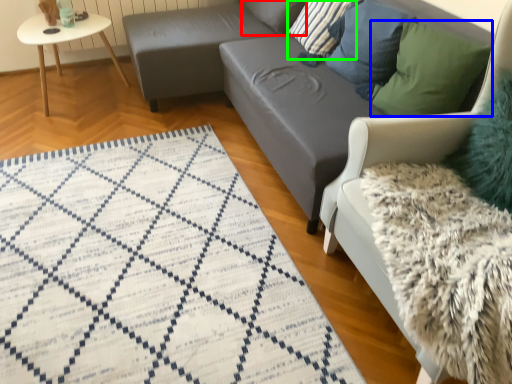
Question: Based on their relative distances, which object is farther from pillow (highlighted by a red box)? Choose from pillow (highlighted by a blue box) and pillow (highlighted by a green box).

Choices:
 (A) pillow
 (B) pillow

Answer: (A)